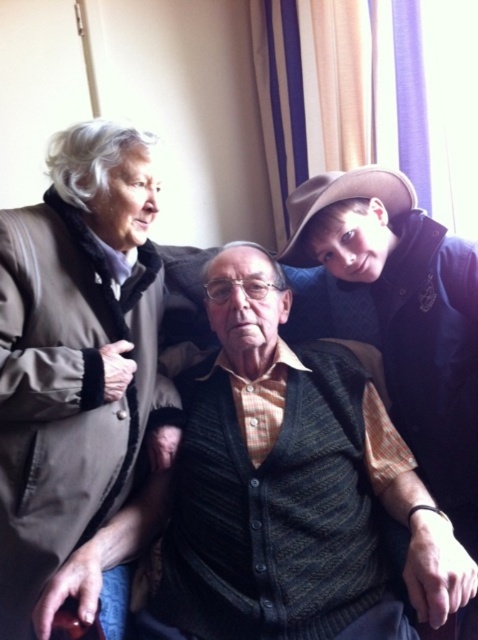
You are a photographer adjusting your camera settings while observing the scene. You notice the matte brown coat at left and the knitted dark green vest at center. Which object is closer to you, the photographer, in this composition?

The matte brown coat at left is closer to you because it is positioned further to the viewer than the knitted dark green vest at center.